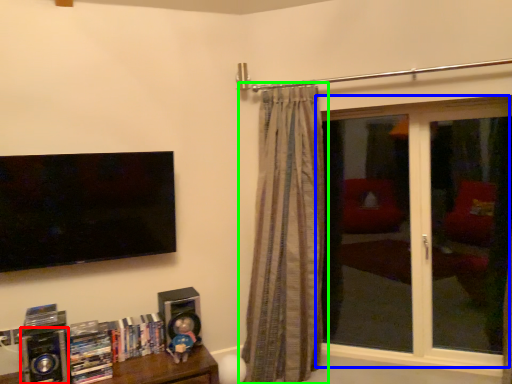
Question: Which object is positioned closest to speaker (highlighted by a red box)? Select from window (highlighted by a blue box) and curtain (highlighted by a green box).

Choices:
 (A) window
 (B) curtain

Answer: (B)